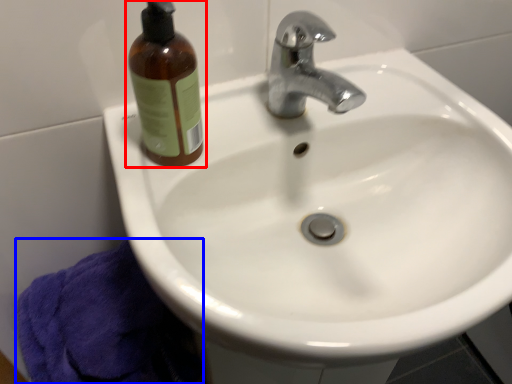
Question: Which of the following is the closest to the observer, bottle (highlighted by a red box) or bath towel (highlighted by a blue box)?

Choices:
 (A) bottle
 (B) bath towel

Answer: (A)